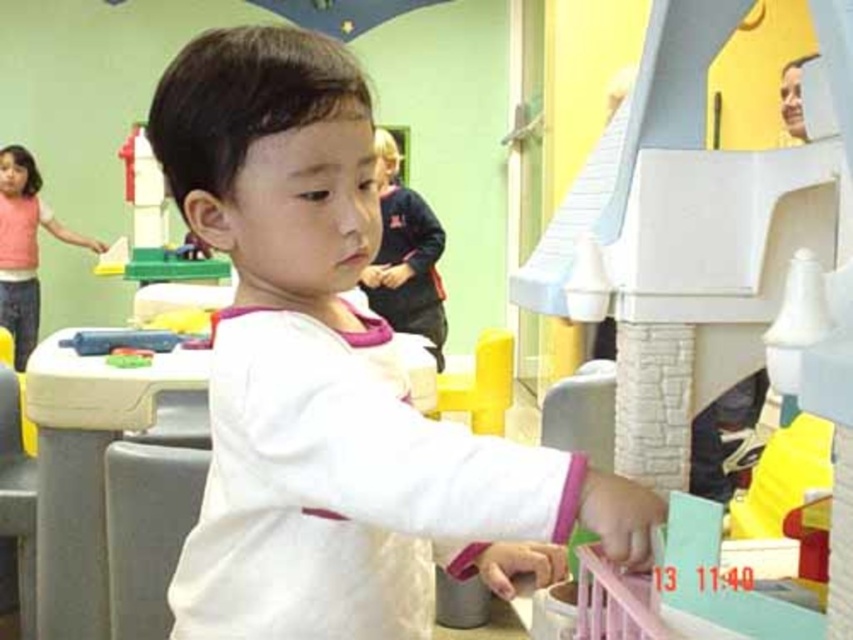
Question: Which point is farther to the camera?

Choices:
 (A) pink fabric shirt at upper left
 (B) white matte shirt at center

Answer: (A)

Question: Where is white matte shirt at center located in relation to pink fabric shirt at upper left in the image?

Choices:
 (A) left
 (B) right

Answer: (B)

Question: Can you confirm if white matte shirt at center is positioned above pink fabric shirt at upper left?

Choices:
 (A) no
 (B) yes

Answer: (A)

Question: Is white matte shirt at center further to the viewer compared to pink fabric shirt at upper left?

Choices:
 (A) no
 (B) yes

Answer: (A)

Question: Which object appears farthest from the camera in this image?

Choices:
 (A) white matte shirt at center
 (B) pink fabric shirt at upper left

Answer: (B)